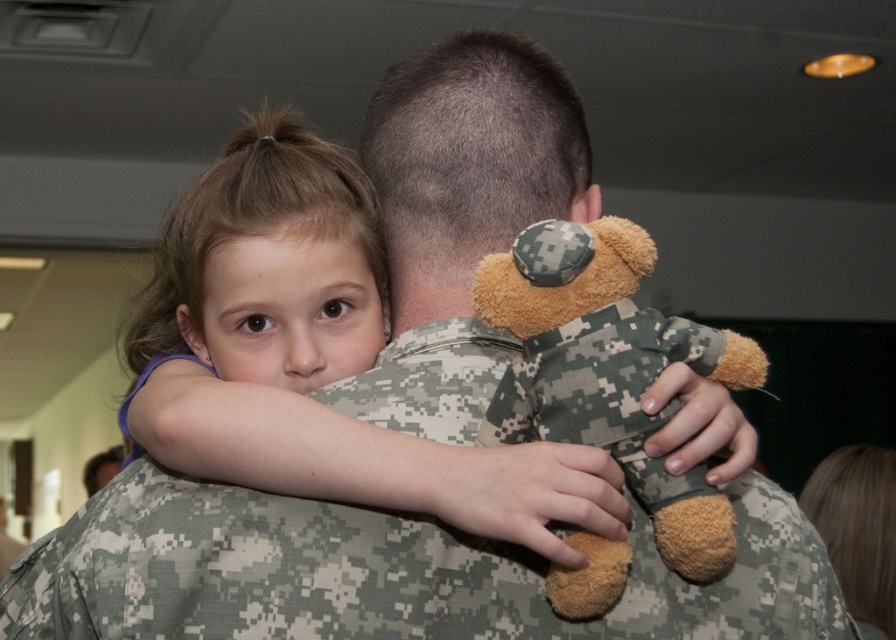
Question: Does matte brown hair at upper left have a larger size compared to camouflage fabric teddy bear at upper center?

Choices:
 (A) yes
 (B) no

Answer: (A)

Question: Among these objects, which one is nearest to the camera?

Choices:
 (A) camouflage fabric teddy bear at upper center
 (B) matte brown hair at upper left

Answer: (B)

Question: Is camouflage fabric uniform at back bigger than matte brown hair at upper left?

Choices:
 (A) yes
 (B) no

Answer: (B)

Question: Does camouflage fabric uniform at back appear under matte brown hair at upper left?

Choices:
 (A) yes
 (B) no

Answer: (A)

Question: Among these objects, which one is nearest to the camera?

Choices:
 (A) camouflage fabric teddy bear at upper center
 (B) matte brown hair at upper left

Answer: (B)

Question: Which object is closer to the camera taking this photo?

Choices:
 (A) camouflage fabric uniform at back
 (B) camouflage fabric teddy bear at upper center
 (C) matte brown hair at upper left

Answer: (C)